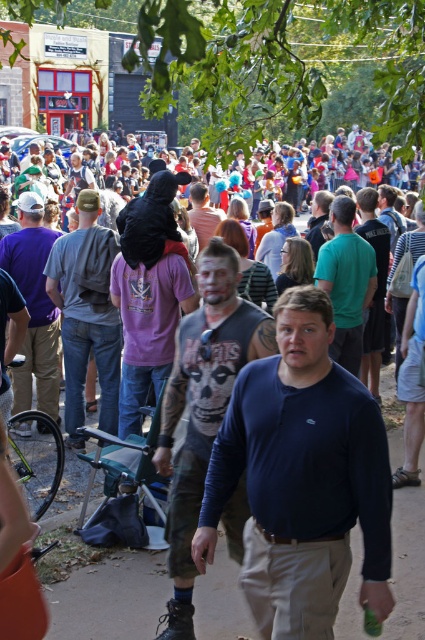
Question: Which point is closer to the camera?

Choices:
 (A) denim jeans at center
 (B) dark blue long-sleeve shirt at center
 (C) matte black shirt at center
 (D) matte gray shirt at center

Answer: (B)

Question: Is dark blue long-sleeve shirt at center bigger than matte gray shirt at center?

Choices:
 (A) no
 (B) yes

Answer: (A)

Question: Which object appears closest to the camera in this image?

Choices:
 (A) purple cotton t-shirt at center
 (B) green matte shirt at center
 (C) denim jeans at center
 (D) dark blue long-sleeve shirt at center

Answer: (D)

Question: Can you confirm if matte gray shirt at center is positioned to the left of purple cotton t-shirt at center?

Choices:
 (A) yes
 (B) no

Answer: (B)

Question: Which of these objects is positioned closest to the purple cotton t-shirt at center?

Choices:
 (A) matte black shirt at center
 (B) matte gray shirt at center

Answer: (B)

Question: Can you confirm if dark blue long-sleeve shirt at center is smaller than matte black shirt at center?

Choices:
 (A) no
 (B) yes

Answer: (B)